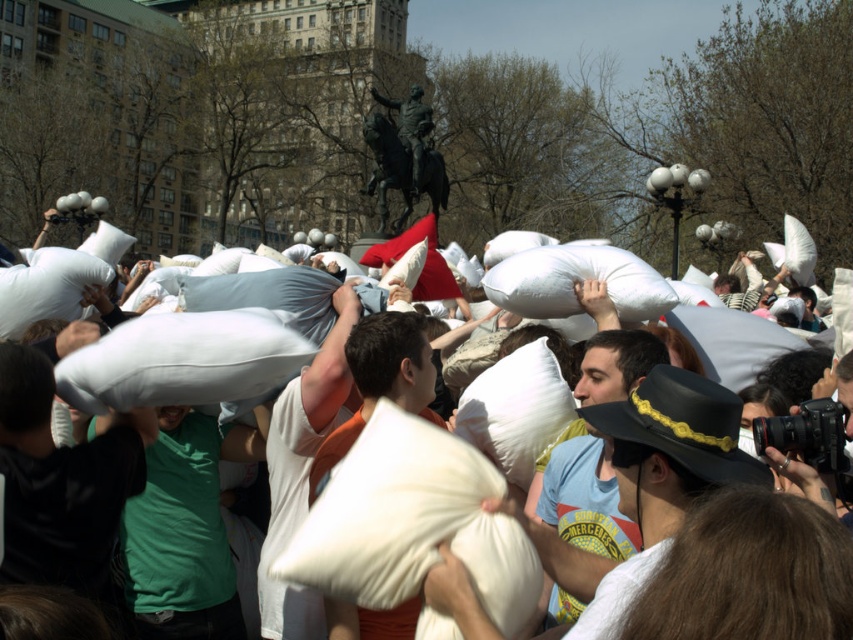
Consider the image. You are a photographer trying to capture the best shot of the pillow fight. You notice the black matte pillow at center and the matte white pillow at center. Which pillow is positioned lower in the image?

The black matte pillow at center is positioned lower than the matte white pillow at center, so it is the one that is lower in the image.

You are a photographer trying to capture a clear shot of the statue in the background. You notice two pillows, the black matte pillow at center and the matte white pillow at center, blocking your view. Which pillow should you move to get a clearer view of the statue?

The black matte pillow at center is shorter than the matte white pillow at center, so moving the matte white pillow at center would allow you to see the statue more clearly since it is taller and blocking more of the view.

You are a photographer trying to capture the entire scene of the pillow fight. You notice the white soft pillows at center and the matte black hat at center. Which object should you focus on first if you want to ensure both are in frame?

The white soft pillows at center is positioned on the left side of matte black hat at center, so you should focus on the matte black hat at center first to ensure both are in frame since it is on the right side and closer to the edge.